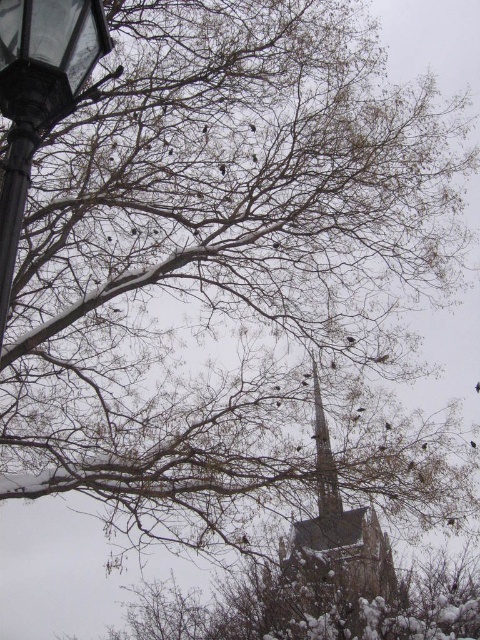
Question: Is snow-covered stone church steeple at center bigger than smooth stone spire at center?

Choices:
 (A) yes
 (B) no

Answer: (A)

Question: Does black metal street light at upper left appear on the right side of black matte bird at upper center?

Choices:
 (A) yes
 (B) no

Answer: (B)

Question: Does black metal street light at upper left appear under black matte bird at upper center?

Choices:
 (A) yes
 (B) no

Answer: (B)

Question: Which object appears farthest from the camera in this image?

Choices:
 (A) black matte bird at upper center
 (B) snow-covered stone church steeple at center
 (C) smooth stone spire at center
 (D) black metal street light at upper left

Answer: (A)

Question: Which point is closer to the camera?

Choices:
 (A) (383, 580)
 (B) (470, 442)

Answer: (A)

Question: Which point is farther to the camera?

Choices:
 (A) snow-covered stone church steeple at center
 (B) smooth stone spire at center
 (C) black metal street light at upper left
 (D) black matte bird at upper center

Answer: (D)